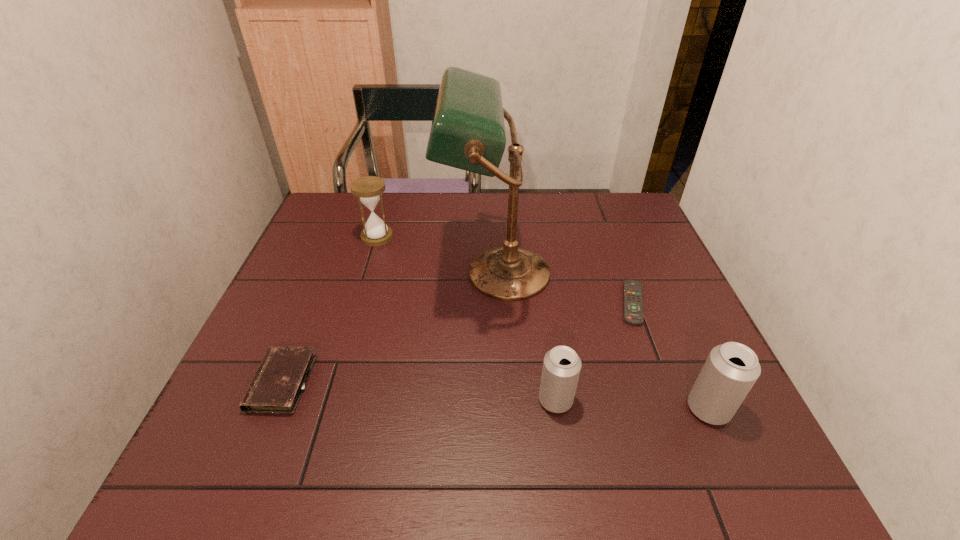
Where is `empty space between the right beer can and the table lamp`? empty space between the right beer can and the table lamp is located at coordinates (602, 341).

Identify which object is the third nearest to the fourth tallest object. Please provide its 2D coordinates. Your answer should be formatted as a tuple, i.e. [(x, y)], where the tuple contains the x and y coordinates of a point satisfying the conditions above.

[(633, 299)]

Find the location of `object identified as the second closest to the table lamp`. object identified as the second closest to the table lamp is located at coordinates (368, 189).

Locate an element on the screen. free location that satisfies the following two spatial constraints: 1. on the back side of the taller beer can; 2. above the green lampshade of the table lamp is located at coordinates (649, 273).

Locate an element on the screen. Image resolution: width=960 pixels, height=540 pixels. free space that satisfies the following two spatial constraints: 1. above the green lampshade of the table lamp; 2. on the back side of the taller beer can is located at coordinates (502, 408).

This screenshot has height=540, width=960. I want to click on blank area in the image that satisfies the following two spatial constraints: 1. above the green lampshade of the table lamp; 2. on the right side of the right beer can, so click(502, 408).

Locate an element on the screen. vacant area in the image that satisfies the following two spatial constraints: 1. above the green lampshade of the shortest object; 2. on the right side of the tallest object is located at coordinates (497, 303).

Image resolution: width=960 pixels, height=540 pixels. In order to click on blank area in the image that satisfies the following two spatial constraints: 1. above the green lampshade of the tallest object; 2. on the right side of the shorter beer can in this screenshot , I will do `click(501, 400)`.

Find the location of a particular element. The height and width of the screenshot is (540, 960). vacant area that satisfies the following two spatial constraints: 1. above the green lampshade of the table lamp; 2. on the right side of the shortest object is located at coordinates (497, 303).

The image size is (960, 540). In order to click on free region that satisfies the following two spatial constraints: 1. above the green lampshade of the left beer can; 2. on the right side of the tallest object in this screenshot , I will do `click(501, 400)`.